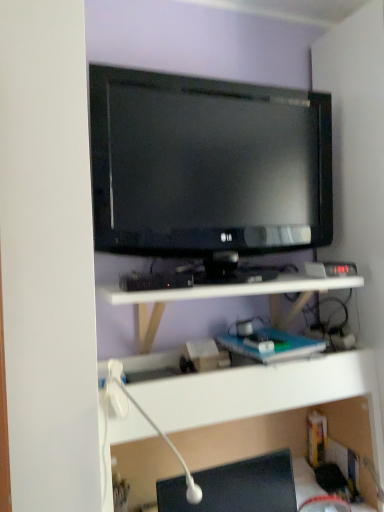
Question: From the image's perspective, is white plastic shelf at lower center, the 2th shelf from the top, above matte black tv at upper center?

Choices:
 (A) no
 (B) yes

Answer: (A)

Question: Can matte black tv at upper center be found inside white plastic shelf at lower center, the 2th shelf from the top?

Choices:
 (A) yes
 (B) no

Answer: (B)

Question: Can you confirm if white plastic shelf at lower center, the 1th shelf in the bottom-to-top sequence, is smaller than matte black tv at upper center?

Choices:
 (A) no
 (B) yes

Answer: (A)

Question: Is white plastic shelf at lower center, the 2th shelf from the top, taller than matte black tv at upper center?

Choices:
 (A) yes
 (B) no

Answer: (A)

Question: Is the surface of white plastic shelf at lower center, the 2th shelf from the top, in direct contact with matte black tv at upper center?

Choices:
 (A) no
 (B) yes

Answer: (A)

Question: From a real-world perspective, is white matte shelf at center, which is the second shelf in bottom-to-top order, positioned above or below white plastic lamp at lower center?

Choices:
 (A) below
 (B) above

Answer: (B)

Question: In terms of size, does white matte shelf at center, which is counted as the first shelf, starting from the top, appear bigger or smaller than white plastic lamp at lower center?

Choices:
 (A) big
 (B) small

Answer: (A)

Question: Visually, is white matte shelf at center, which is counted as the first shelf, starting from the top, positioned to the left or to the right of white plastic lamp at lower center?

Choices:
 (A) right
 (B) left

Answer: (A)

Question: Considering the positions of white matte shelf at center, which is counted as the first shelf, starting from the top, and white plastic lamp at lower center in the image, is white matte shelf at center, which is counted as the first shelf, starting from the top, wider or thinner than white plastic lamp at lower center?

Choices:
 (A) wide
 (B) thin

Answer: (A)

Question: Visually, is white plastic shelf at lower center, the 2th shelf from the top, positioned to the left or to the right of black glossy desktop at lower right?

Choices:
 (A) left
 (B) right

Answer: (B)

Question: Considering their positions, is white plastic shelf at lower center, the 1th shelf in the bottom-to-top sequence, located in front of or behind black glossy desktop at lower right?

Choices:
 (A) behind
 (B) front

Answer: (B)

Question: Is point (327, 362) positioned closer to the camera than point (238, 471)?

Choices:
 (A) farther
 (B) closer

Answer: (A)

Question: Do you think white plastic shelf at lower center, the 1th shelf in the bottom-to-top sequence, is within black glossy desktop at lower right, or outside of it?

Choices:
 (A) outside
 (B) inside

Answer: (A)

Question: In terms of size, does white plastic shelf at lower center, the 1th shelf in the bottom-to-top sequence, appear bigger or smaller than white matte shelf at center, which is the second shelf in bottom-to-top order?

Choices:
 (A) big
 (B) small

Answer: (A)

Question: Based on their positions, is white plastic shelf at lower center, the 1th shelf in the bottom-to-top sequence, located to the left or right of white matte shelf at center, which is the second shelf in bottom-to-top order?

Choices:
 (A) left
 (B) right

Answer: (B)